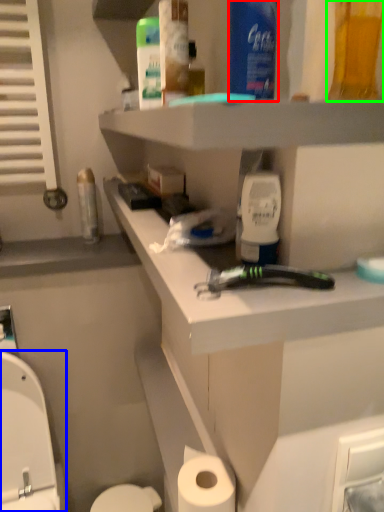
Question: Estimate the real-world distances between objects in this image. Which object is closer to mouthwash (highlighted by a red box), sit (highlighted by a blue box) or mouthwash (highlighted by a green box)?

Choices:
 (A) sit
 (B) mouthwash

Answer: (B)